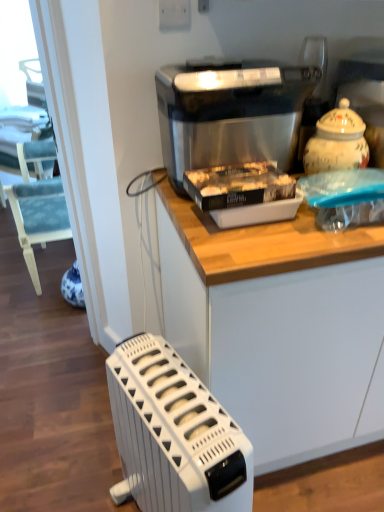
Locate an element on the screen. The image size is (384, 512). vacant space in front of stainless steel ice maker at center is located at coordinates (253, 243).